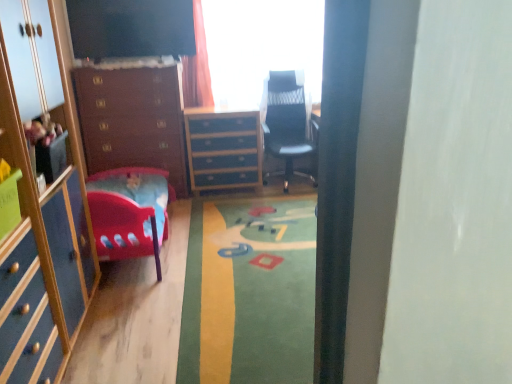
Question: Is transparent glass window at upper center facing away from matte blue cabinet at left?

Choices:
 (A) yes
 (B) no

Answer: (B)

Question: Is transparent glass window at upper center not inside matte blue cabinet at left?

Choices:
 (A) no
 (B) yes

Answer: (B)

Question: Is transparent glass window at upper center positioned behind matte blue cabinet at left?

Choices:
 (A) yes
 (B) no

Answer: (A)

Question: Could you tell me if transparent glass window at upper center is facing matte blue cabinet at left?

Choices:
 (A) no
 (B) yes

Answer: (B)

Question: From the image's perspective, is transparent glass window at upper center on matte blue cabinet at left?

Choices:
 (A) no
 (B) yes

Answer: (B)

Question: Does transparent glass window at upper center have a smaller size compared to matte blue cabinet at left?

Choices:
 (A) no
 (B) yes

Answer: (B)

Question: Is blue painted wood chest of drawers at center, acting as the first chest of drawers starting from the right, thinner than black mesh office chair at center?

Choices:
 (A) no
 (B) yes

Answer: (B)

Question: Is black mesh office chair at center located within blue painted wood chest of drawers at center, acting as the first chest of drawers starting from the right?

Choices:
 (A) yes
 (B) no

Answer: (B)

Question: Does blue painted wood chest of drawers at center, acting as the first chest of drawers starting from the right, have a smaller size compared to black mesh office chair at center?

Choices:
 (A) yes
 (B) no

Answer: (A)

Question: From a real-world perspective, is blue painted wood chest of drawers at center, which is counted as the 2th chest of drawers, starting from the left, on top of black mesh office chair at center?

Choices:
 (A) no
 (B) yes

Answer: (A)

Question: Is blue painted wood chest of drawers at center, acting as the first chest of drawers starting from the right, shorter than black mesh office chair at center?

Choices:
 (A) yes
 (B) no

Answer: (A)

Question: Is blue painted wood chest of drawers at center, acting as the first chest of drawers starting from the right, oriented towards black mesh office chair at center?

Choices:
 (A) yes
 (B) no

Answer: (B)

Question: Considering the relative sizes of transparent glass window at upper center and blue painted wood chest of drawers at center, which is counted as the 2th chest of drawers, starting from the left, in the image provided, is transparent glass window at upper center smaller than blue painted wood chest of drawers at center, which is counted as the 2th chest of drawers, starting from the left,?

Choices:
 (A) yes
 (B) no

Answer: (B)